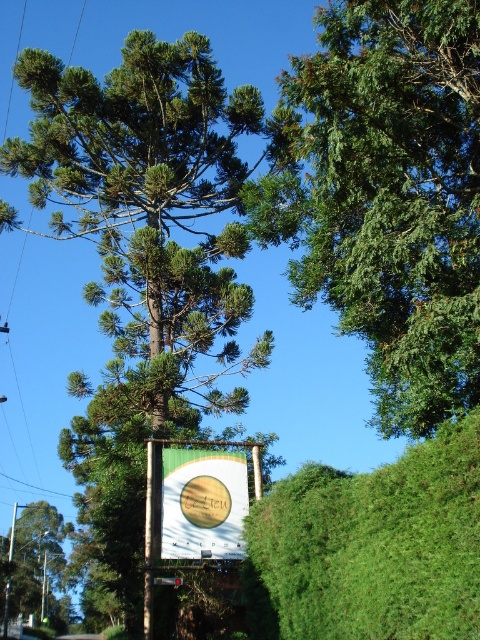
Consider the image. Which is below, green leafy hedge at lower right or green leafy tree at left?

green leafy tree at left is below.

Does green leafy hedge at lower right appear on the right side of green leafy tree at left?

Yes, green leafy hedge at lower right is to the right of green leafy tree at left.

Identify the location of green leafy hedge at lower right. This screenshot has width=480, height=640. (372, 547).

Identify the location of green leafy hedge at lower right. The width and height of the screenshot is (480, 640). (372, 547).

Which is below, green textured tree at center or green fabric sign at center?

green fabric sign at center is below.

Which of these two, green textured tree at center or green fabric sign at center, stands shorter?

With less height is green fabric sign at center.

Identify the location of green textured tree at center. (144, 234).

Does green needle-like at upper center appear over green fabric sign at center?

Yes, green needle-like at upper center is above green fabric sign at center.

Who is more distant from viewer, (355, 35) or (222, 504)?

Point (222, 504)

Between point (321, 241) and point (201, 509), which one is positioned in front?

Point (201, 509)

This screenshot has height=640, width=480. What are the coordinates of `green needle-like at upper center` in the screenshot? It's located at (386, 195).